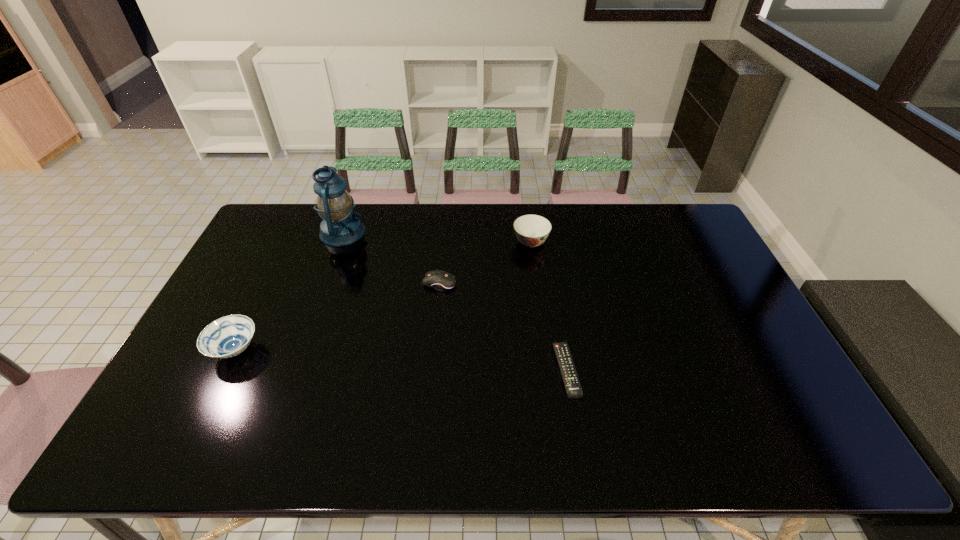
The height and width of the screenshot is (540, 960). What are the coordinates of `vacant area that lies between the third farthest object and the tallest object` in the screenshot? It's located at (392, 258).

Where is `vacant area between the third object from left to right and the right soup bowl`? This screenshot has width=960, height=540. vacant area between the third object from left to right and the right soup bowl is located at coordinates (486, 263).

Locate which object is the fourth closest to the lantern. Please provide its 2D coordinates. Your answer should be formatted as a tuple, i.e. [(x, y)], where the tuple contains the x and y coordinates of a point satisfying the conditions above.

[(570, 378)]

Identify the location of the fourth closest object relative to the right soup bowl. (x=228, y=336).

At what (x,y) coordinates should I click in order to perform the action: click on vacant area that satisfies the following two spatial constraints: 1. on the back side of the right soup bowl; 2. on the face of the tallest object. Please return your answer as a coordinate pair (x, y). Image resolution: width=960 pixels, height=540 pixels. Looking at the image, I should click on (530, 233).

Where is `blank space that satisfies the following two spatial constraints: 1. on the front side of the left soup bowl; 2. on the right side of the shortest object`? This screenshot has width=960, height=540. blank space that satisfies the following two spatial constraints: 1. on the front side of the left soup bowl; 2. on the right side of the shortest object is located at coordinates (226, 370).

In order to click on vacant area in the image that satisfies the following two spatial constraints: 1. on the face of the fourth object from right to left; 2. on the right side of the fourth tallest object in this screenshot , I will do `click(324, 284)`.

The image size is (960, 540). Find the location of `free space that satisfies the following two spatial constraints: 1. on the face of the lantern; 2. on the right side of the third object from left to right`. free space that satisfies the following two spatial constraints: 1. on the face of the lantern; 2. on the right side of the third object from left to right is located at coordinates (324, 284).

Find the location of a particular element. This screenshot has height=540, width=960. free space in the image that satisfies the following two spatial constraints: 1. on the face of the fourth object from right to left; 2. on the left side of the shortest object is located at coordinates (294, 370).

Where is `free space that satisfies the following two spatial constraints: 1. on the front side of the shortest object; 2. on the right side of the left soup bowl`? free space that satisfies the following two spatial constraints: 1. on the front side of the shortest object; 2. on the right side of the left soup bowl is located at coordinates (226, 370).